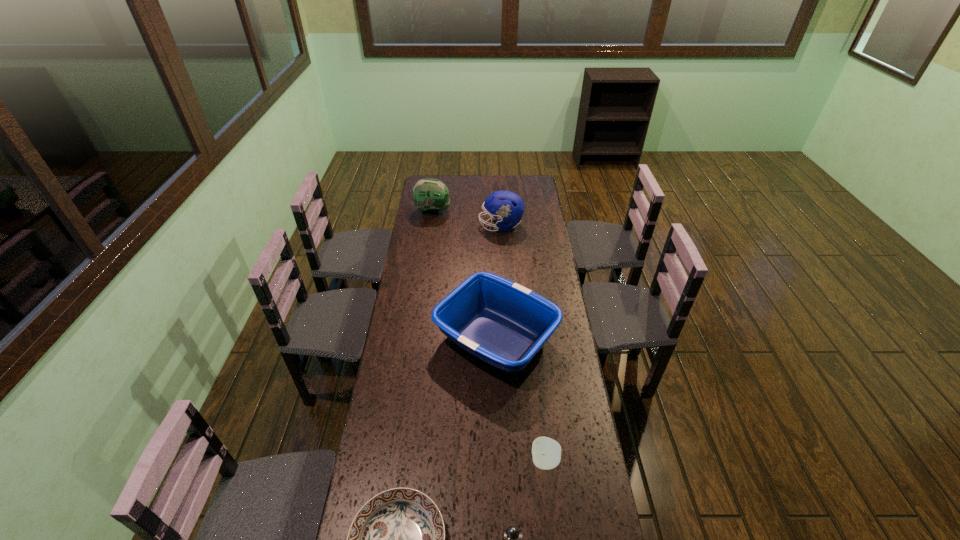
Identify the location of object that stands as the closest to the right football helmet. (430, 195).

Locate which object is the third closest to the fourth farthest object. Please provide its 2D coordinates. Your answer should be formatted as a tuple, i.e. [(x, y)], where the tuple contains the x and y coordinates of a point satisfying the conditions above.

[(397, 539)]

Locate an element on the screen. The height and width of the screenshot is (540, 960). free space in the image that satisfies the following two spatial constraints: 1. on the visor of the third nearest object; 2. on the right side of the left football helmet is located at coordinates (397, 461).

Where is `vacant area that satisfies the following two spatial constraints: 1. on the visor of the left football helmet; 2. on the left side of the third farthest object`? vacant area that satisfies the following two spatial constraints: 1. on the visor of the left football helmet; 2. on the left side of the third farthest object is located at coordinates (415, 338).

Identify the location of free space that satisfies the following two spatial constraints: 1. on the face guard of the apple; 2. on the right side of the right football helmet. The image size is (960, 540). (515, 461).

Locate an element on the screen. The width and height of the screenshot is (960, 540). free space that satisfies the following two spatial constraints: 1. on the face guard of the fourth farthest object; 2. on the right side of the right football helmet is located at coordinates (515, 461).

Where is `vacant space that satisfies the following two spatial constraints: 1. on the visor of the left football helmet; 2. on the left side of the apple`? This screenshot has width=960, height=540. vacant space that satisfies the following two spatial constraints: 1. on the visor of the left football helmet; 2. on the left side of the apple is located at coordinates (397, 461).

Where is `free region that satisfies the following two spatial constraints: 1. on the visor of the left football helmet; 2. on the back side of the apple`? free region that satisfies the following two spatial constraints: 1. on the visor of the left football helmet; 2. on the back side of the apple is located at coordinates (397, 461).